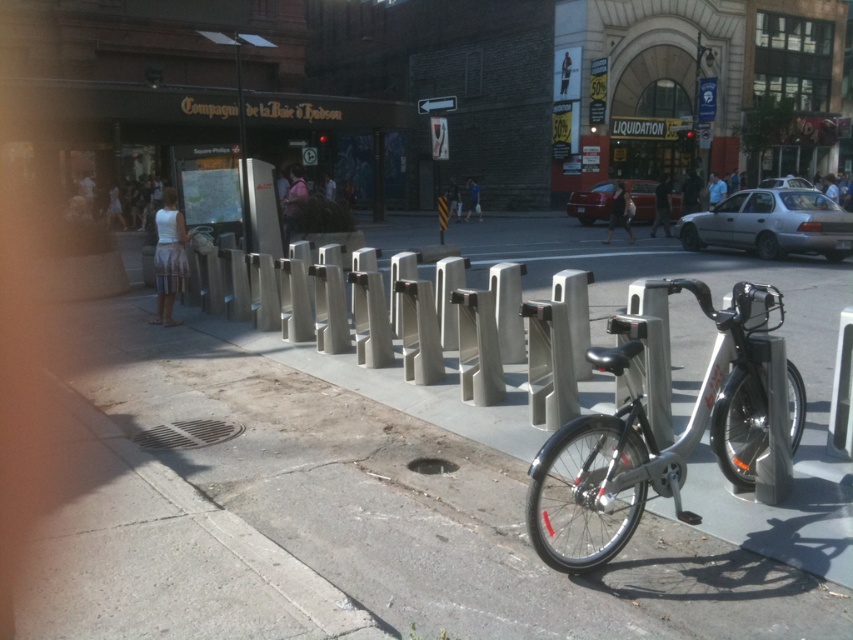
In the scene shown: You are a delivery person who needs to place a small box on the ground. You have two options in the scene to place it either on the gray concrete sidewalk at center or the silver metallic bicycle at center. Which surface is lower to the ground and more suitable for placing the box without it rolling away?

The gray concrete sidewalk at center has a lesser height compared to the silver metallic bicycle at center, so placing the box on the gray concrete sidewalk at center would be more suitable as it is lower to the ground and less likely to cause the box to roll away.

In the scene shown: You are a delivery person who needs to place a heavy box on the gray concrete sidewalk at center. However, there is a silver metallic bicycle at center in the way. Can you move the bicycle to make space for the box?

The gray concrete sidewalk at center is below the silver metallic bicycle at center, meaning the bicycle is currently occupying the space where you want to place the box. You will need to move the silver metallic bicycle at center to make room for the heavy box.

You are a delivery person who needs to place a package on the gray concrete sidewalk at center. However, there is a silver metallic bicycle at center in the way. Can you move the bicycle to make space for the package?

The gray concrete sidewalk at center is smaller than the silver metallic bicycle at center, so moving the bicycle would free up enough space to place the package on the sidewalk.